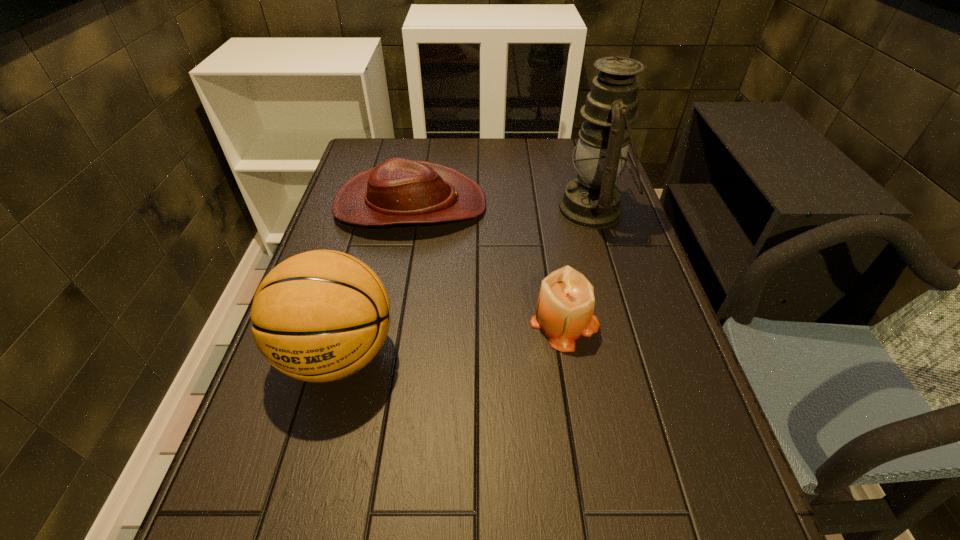
Locate an element on the screen. This screenshot has width=960, height=540. unoccupied position between the third tallest object and the shortest object is located at coordinates (488, 262).

You are a GUI agent. You are given a task and a screenshot of the screen. Output one action in this format:
    pyautogui.click(x=<x>, y=<y>)
    Task: Click on the vacant space in between the basketball and the candle
    
    Given the screenshot: What is the action you would take?
    pyautogui.click(x=451, y=337)

Image resolution: width=960 pixels, height=540 pixels. What are the coordinates of `vacant region between the candle and the second tallest object` in the screenshot? It's located at (451, 337).

Where is `free area in between the second shortest object and the second tallest object`? Image resolution: width=960 pixels, height=540 pixels. free area in between the second shortest object and the second tallest object is located at coordinates (451, 337).

At what (x,y) coordinates should I click in order to perform the action: click on free space between the candle and the tallest object. Please return your answer as a coordinate pair (x, y). This screenshot has height=540, width=960. Looking at the image, I should click on (579, 265).

Locate an element on the screen. The image size is (960, 540). object that is the second nearest to the basketball is located at coordinates (565, 306).

The height and width of the screenshot is (540, 960). I want to click on the third closest object to the shortest object, so click(x=319, y=316).

Image resolution: width=960 pixels, height=540 pixels. Find the location of `free location that satisfies the following two spatial constraints: 1. on the front-facing side of the cowboy hat; 2. on the right side of the third tallest object`. free location that satisfies the following two spatial constraints: 1. on the front-facing side of the cowboy hat; 2. on the right side of the third tallest object is located at coordinates (389, 321).

Identify the location of vacant space that satisfies the following two spatial constraints: 1. on the front-facing side of the shortest object; 2. on the surface of the basketball near the brand logo. This screenshot has width=960, height=540. (383, 354).

Where is `free point that satisfies the following two spatial constraints: 1. on the back side of the second shortest object; 2. on the front-facing side of the shortest object`? This screenshot has width=960, height=540. free point that satisfies the following two spatial constraints: 1. on the back side of the second shortest object; 2. on the front-facing side of the shortest object is located at coordinates (544, 205).